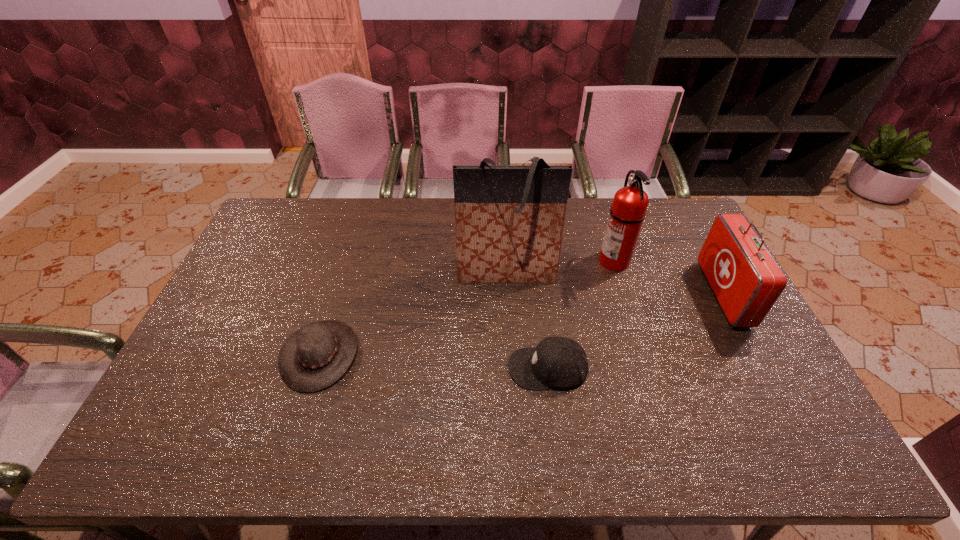
The width and height of the screenshot is (960, 540). Find the location of `vacant area between the fourth object from left to right and the first-aid kit`. vacant area between the fourth object from left to right and the first-aid kit is located at coordinates (669, 277).

Where is `free point between the rightmost object and the fourth shortest object`? free point between the rightmost object and the fourth shortest object is located at coordinates (669, 277).

Image resolution: width=960 pixels, height=540 pixels. Identify the location of free area in between the fourth shortest object and the tallest object. (561, 266).

Where is `free space that is in between the leftmost object and the shopping bag`? The height and width of the screenshot is (540, 960). free space that is in between the leftmost object and the shopping bag is located at coordinates (413, 313).

What are the coordinates of `the fourth closest object relative to the fourth shortest object` in the screenshot? It's located at (317, 355).

Locate which object ranks in proximity to the leftmost object. Please provide its 2D coordinates. Your answer should be formatted as a tuple, i.e. [(x, y)], where the tuple contains the x and y coordinates of a point satisfying the conditions above.

[(509, 219)]

Where is `vacant point that satisfies the following two spatial constraints: 1. at the nozzle of the fire extinguisher; 2. on the front-facing side of the shopping bag`? This screenshot has width=960, height=540. vacant point that satisfies the following two spatial constraints: 1. at the nozzle of the fire extinguisher; 2. on the front-facing side of the shopping bag is located at coordinates (617, 272).

Identify the location of vacant space that satisfies the following two spatial constraints: 1. on the front-facing side of the tallest object; 2. on the front-facing side of the leftmost object. Image resolution: width=960 pixels, height=540 pixels. (512, 354).

The height and width of the screenshot is (540, 960). Identify the location of free location that satisfies the following two spatial constraints: 1. at the nozzle of the second tallest object; 2. on the front-facing side of the tallest object. click(617, 272).